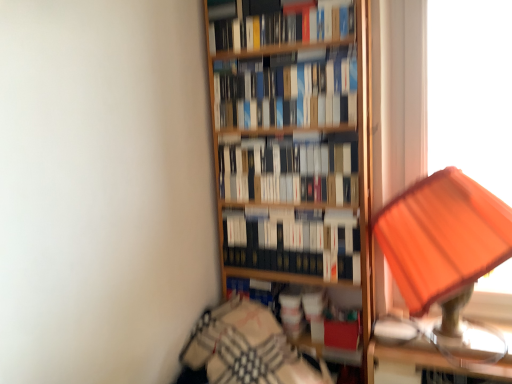
I want to click on vacant area situated below hardcover books at center, acting as the 3th book starting from the top (from a real-world perspective), so click(x=287, y=206).